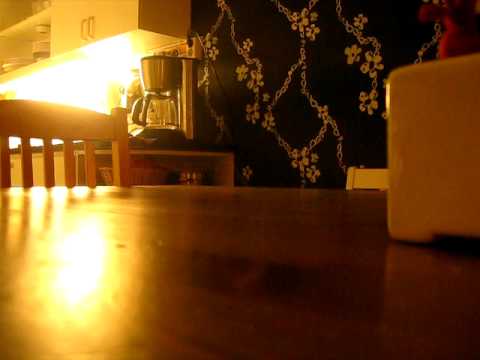
Image resolution: width=480 pixels, height=360 pixels. I want to click on pot, so click(169, 72).